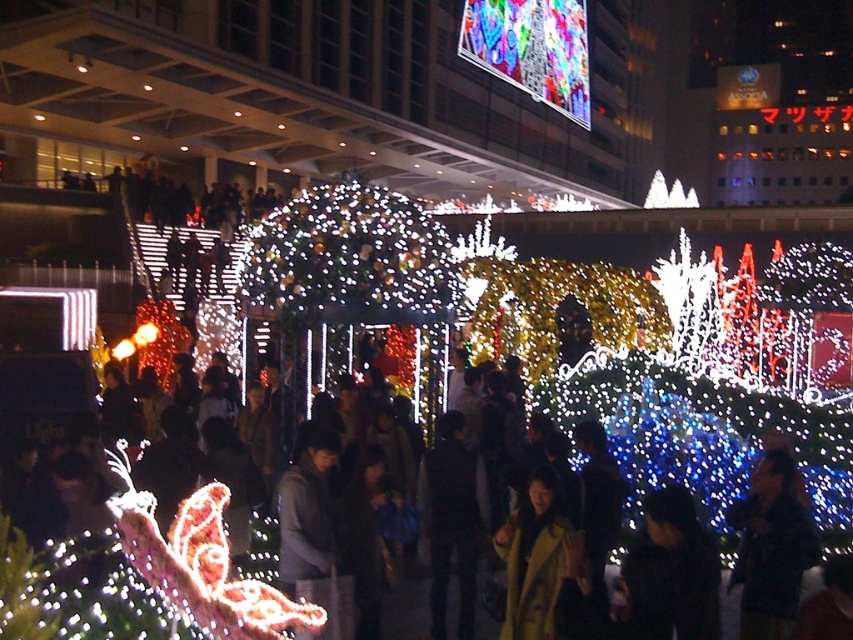
Question: Does matte white lights at center appear on the left side of yellow matte coat at center?

Choices:
 (A) no
 (B) yes

Answer: (B)

Question: Which object is closer to the camera taking this photo?

Choices:
 (A) dark blue fabric jacket at lower right
 (B) matte white lights at center

Answer: (B)

Question: Which of the following is the farthest from the observer?

Choices:
 (A) yellow matte coat at center
 (B) matte white lights at center
 (C) dark blue fabric jacket at lower right

Answer: (C)

Question: Where is matte white lights at center located in relation to dark blue fabric jacket at lower right in the image?

Choices:
 (A) left
 (B) right

Answer: (A)

Question: Which object is the closest to the matte white lights at center?

Choices:
 (A) yellow matte coat at center
 (B) dark blue fabric jacket at lower right

Answer: (A)

Question: Is matte white lights at center to the left of dark blue fabric jacket at lower right from the viewer's perspective?

Choices:
 (A) no
 (B) yes

Answer: (B)